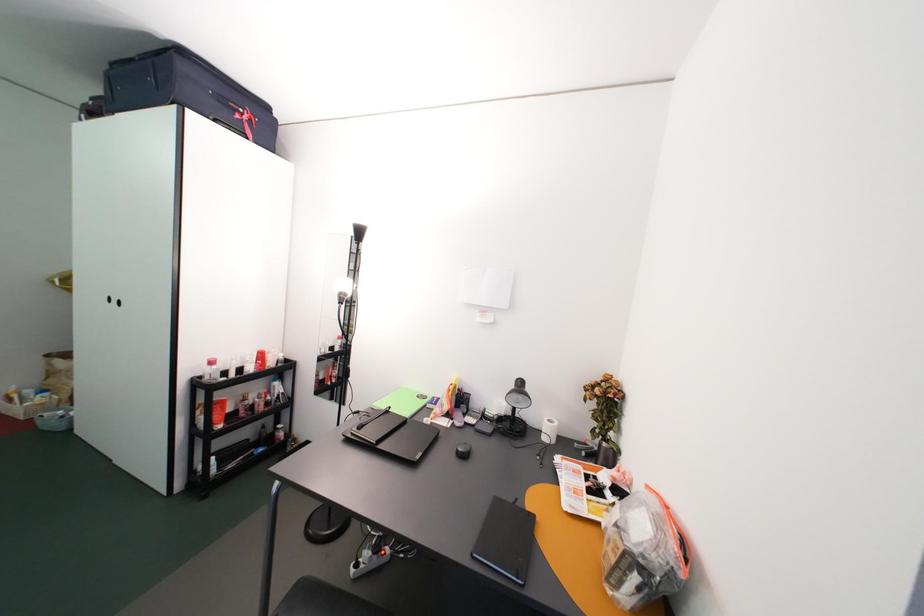
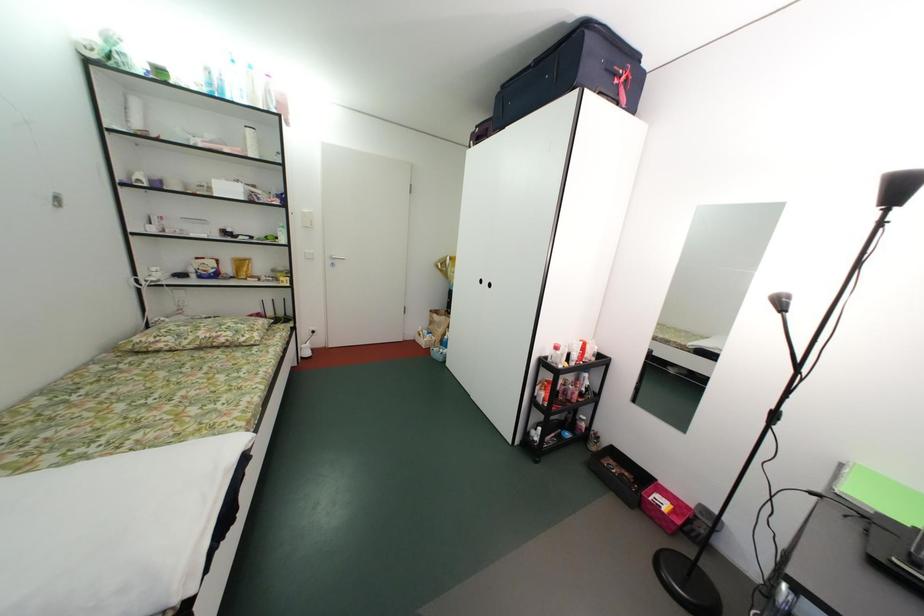
Question: The camera is either moving clockwise (left) or counter-clockwise (right) around the object. The first image is from the beginning of the video and the second image is from the end. Is the camera moving left or right when shooting the video?

Choices:
 (A) Left
 (B) Right

Answer: (B)